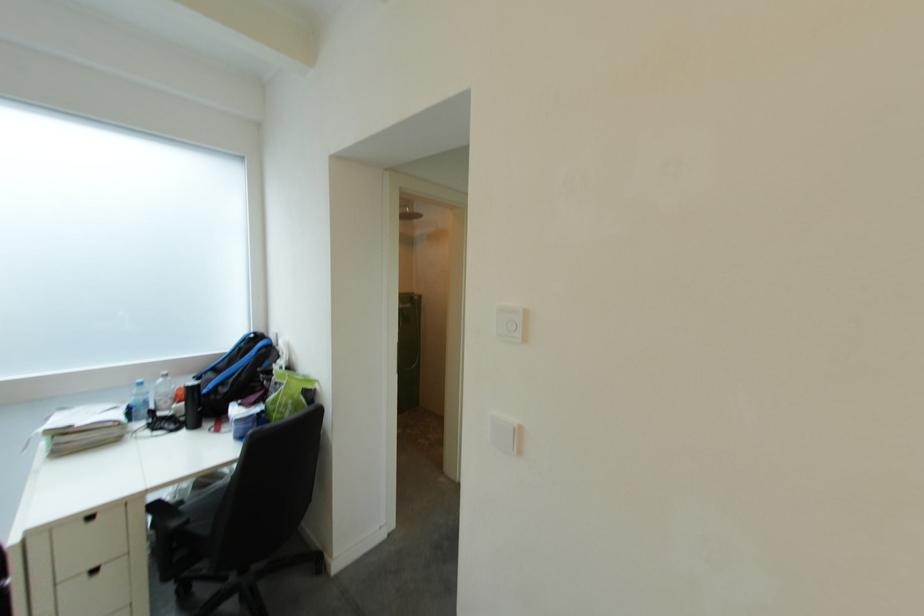
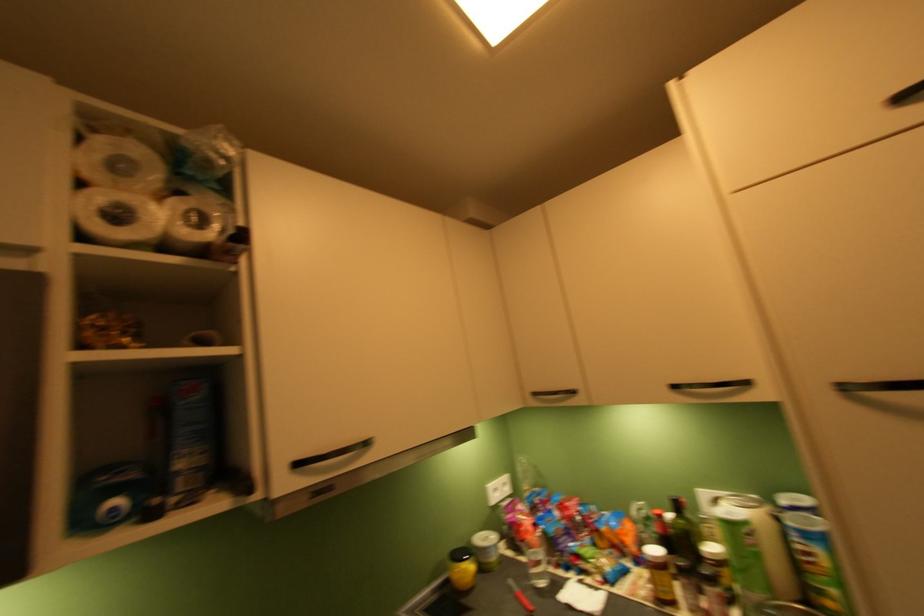
The images are taken continuously from a first-person perspective. In which direction are you moving?

The movement direction of the cameraman is right, forward.